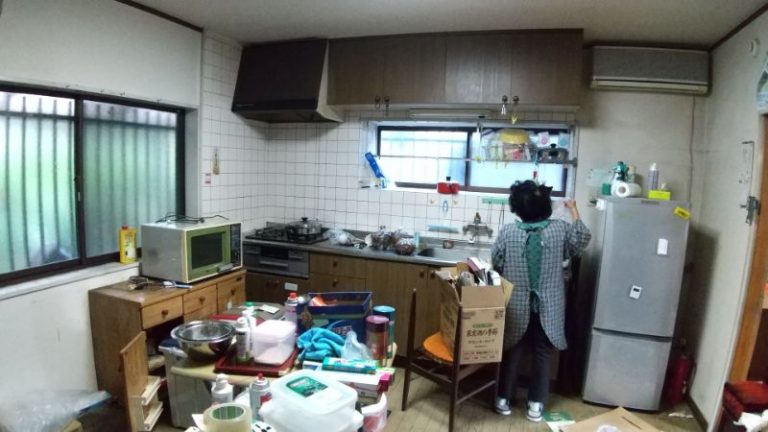
This screenshot has width=768, height=432. In order to click on entrance in this screenshot , I will do `click(753, 297)`.